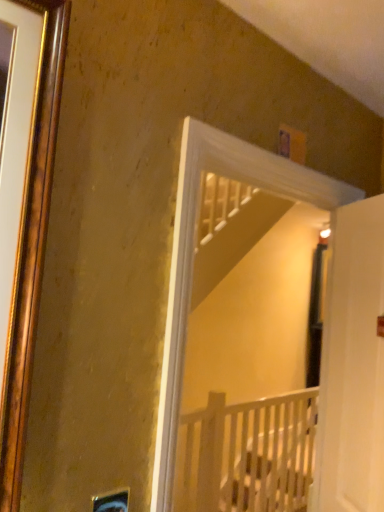
What do you see at coordinates (247, 454) in the screenshot?
I see `white wooden crib at center` at bounding box center [247, 454].

Where is `white wooden crib at center`? This screenshot has width=384, height=512. white wooden crib at center is located at coordinates (247, 454).

Identify the location of white matte door at right. (352, 365).

The image size is (384, 512). Describe the element at coordinates (352, 365) in the screenshot. I see `white matte door at right` at that location.

At what (x,y) coordinates should I click in order to perform the action: click on white wooden crib at center. Please return your answer as a coordinate pair (x, y). The width and height of the screenshot is (384, 512). Looking at the image, I should click on (247, 454).

Is white wooden crib at center to the right of white matte door at right from the viewer's perspective?

No, white wooden crib at center is not to the right of white matte door at right.

Considering the positions of objects white wooden crib at center and white matte door at right in the image provided, who is behind, white wooden crib at center or white matte door at right?

white wooden crib at center is more distant.

Considering the positions of point (182, 476) and point (364, 441), is point (182, 476) closer or farther from the camera than point (364, 441)?

Clearly, point (182, 476) is more distant from the camera than point (364, 441).

Consider the image. From the image's perspective, is white wooden crib at center beneath white matte door at right?

Correct, white wooden crib at center appears lower than white matte door at right in the image.

From a real-world perspective, is white wooden crib at center below white matte door at right?

Yes.

Considering the sizes of white wooden crib at center and white matte door at right in the image, is white wooden crib at center wider or thinner than white matte door at right?

Considering their sizes, white wooden crib at center looks broader than white matte door at right.

Is white wooden crib at center taller or shorter than white matte door at right?

Clearly, white wooden crib at center is shorter compared to white matte door at right.

Does white wooden crib at center have a larger size compared to white matte door at right?

Yes, white wooden crib at center is bigger than white matte door at right.

Would you say white wooden crib at center is inside or outside white matte door at right?

white wooden crib at center cannot be found inside white matte door at right.

Is white wooden crib at center beside white matte door at right?

No, white wooden crib at center is not touching white matte door at right.

Is white wooden crib at center positioned with its back to white matte door at right?

No, white wooden crib at center is not facing away from white matte door at right.

Identify the location of infant bed behind the white matte door at right. The height and width of the screenshot is (512, 384). pos(247,454).

Looking at this image, is white matte door at right to the right of white wooden crib at center from the viewer's perspective?

Correct, you'll find white matte door at right to the right of white wooden crib at center.

Is the position of white matte door at right more distant than that of white wooden crib at center?

That is False.

Which point is more distant from viewer, (323, 428) or (315, 398)?

The point (315, 398) is more distant.

From the image's perspective, which is below, white matte door at right or white wooden crib at center?

white wooden crib at center.

From a real-world perspective, is white matte door at right positioned under white wooden crib at center based on gravity?

No, from a real-world perspective, white matte door at right is not under white wooden crib at center.

Between white matte door at right and white wooden crib at center, which one has larger width?

white wooden crib at center.

Considering the relative sizes of white matte door at right and white wooden crib at center in the image provided, is white matte door at right taller than white wooden crib at center?

Indeed, white matte door at right has a greater height compared to white wooden crib at center.

In terms of size, does white matte door at right appear bigger or smaller than white wooden crib at center?

In the image, white matte door at right appears to be smaller than white wooden crib at center.

Which is correct: white matte door at right is inside white wooden crib at center, or outside of it?

white matte door at right is not inside white wooden crib at center, it's outside.

Is white matte door at right with white wooden crib at center?

No.

Is white matte door at right facing towards white wooden crib at center?

No, white matte door at right is not oriented towards white wooden crib at center.

What's the angular difference between white matte door at right and white wooden crib at center's facing directions?

The angular difference between white matte door at right and white wooden crib at center is 119 degrees.

At what (x,y) coordinates should I click in order to perform the action: click on door above the white wooden crib at center (from the image's perspective). Please return your answer as a coordinate pair (x, y). The height and width of the screenshot is (512, 384). Looking at the image, I should click on (352, 365).

I want to click on door that appears above the white wooden crib at center (from a real-world perspective), so click(352, 365).

Identify the location of infant bed beneath the white matte door at right (from a real-world perspective). (247, 454).